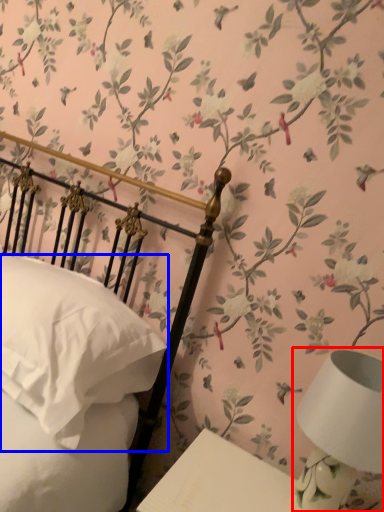
Question: Among these objects, which one is nearest to the camera, table lamp (highlighted by a red box) or pillow (highlighted by a blue box)?

Choices:
 (A) table lamp
 (B) pillow

Answer: (A)